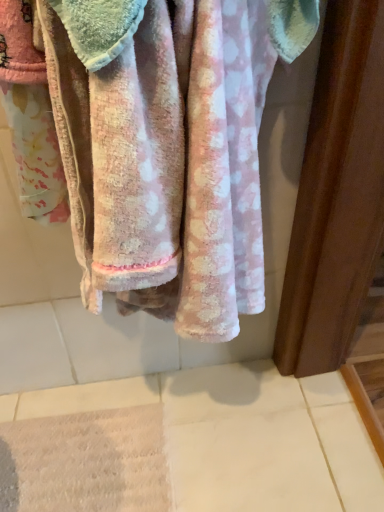
You are a GUI agent. You are given a task and a screenshot of the screen. Output one action in this format:
    pyautogui.click(x=<x>, y=<y>)
    Task: Click on the beige textured bath mat at lower left
    This screenshot has width=384, height=512.
    Given the screenshot: What is the action you would take?
    pyautogui.click(x=85, y=462)

The height and width of the screenshot is (512, 384). What do you see at coordinates (85, 462) in the screenshot?
I see `beige textured bath mat at lower left` at bounding box center [85, 462].

In the scene shown: In order to face beige textured bath mat at lower left, should I rotate leftwards or rightwards?

To face it directly, rotate left by 14.876 degrees.

Find the location of a particular element. beige textured bath mat at lower left is located at coordinates (85, 462).